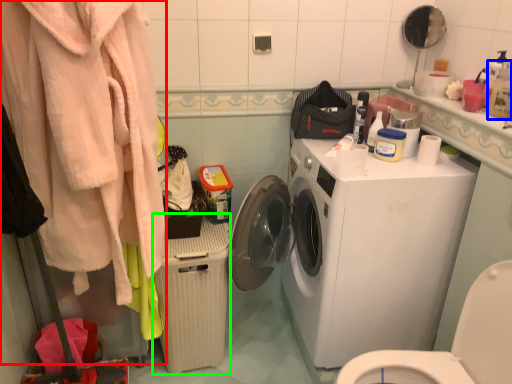
Question: Estimate the real-world distances between objects in this image. Which object is closer to clothing (highlighted by a red box), cleaning product (highlighted by a blue box) or dish washer (highlighted by a green box)?

Choices:
 (A) cleaning product
 (B) dish washer

Answer: (B)